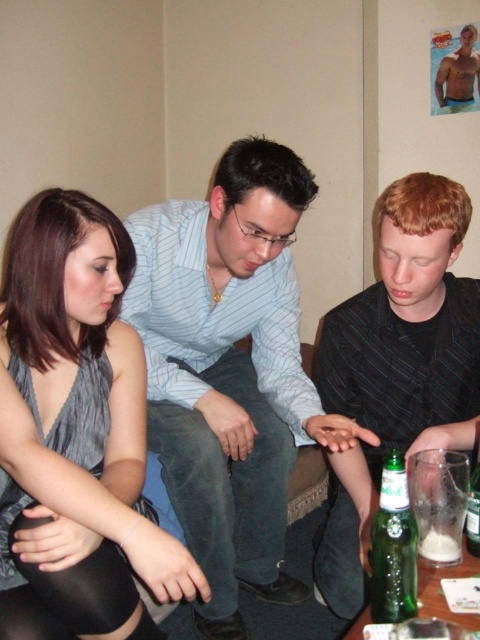
Is light blue striped shirt at center below muscular tan torso at upper right?

Indeed, light blue striped shirt at center is positioned under muscular tan torso at upper right.

Consider the image. Does light blue striped shirt at center have a smaller size compared to muscular tan torso at upper right?

Actually, light blue striped shirt at center might be larger than muscular tan torso at upper right.

Locate an element on the screen. The width and height of the screenshot is (480, 640). light blue striped shirt at center is located at coordinates (232, 372).

Between green glass bottle at lower center and green glass bottle at lower right, which one is positioned lower?

green glass bottle at lower center is lower down.

Does green glass bottle at lower center appear over green glass bottle at lower right?

No, green glass bottle at lower center is not above green glass bottle at lower right.

Where is `green glass bottle at lower center`? This screenshot has height=640, width=480. green glass bottle at lower center is located at coordinates (393, 547).

Between light blue striped shirt at center and gray satin dress at lower left, which one appears on the left side from the viewer's perspective?

From the viewer's perspective, gray satin dress at lower left appears more on the left side.

Does light blue striped shirt at center have a greater width compared to gray satin dress at lower left?

Correct, the width of light blue striped shirt at center exceeds that of gray satin dress at lower left.

Between point (175, 378) and point (96, 440), which one is positioned in front?

Point (96, 440) is in front.

You are a GUI agent. You are given a task and a screenshot of the screen. Output one action in this format:
    pyautogui.click(x=<x>, y=<y>)
    Task: Click on the light blue striped shirt at center
    
    Given the screenshot: What is the action you would take?
    pyautogui.click(x=232, y=372)